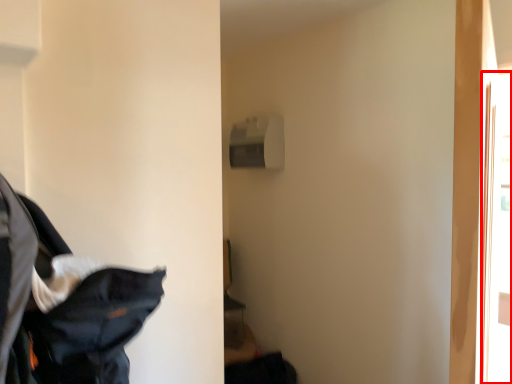
Question: Considering the relative positions of screen door (annotated by the red box) and laundry in the image provided, where is screen door (annotated by the red box) located with respect to the staircase?

Choices:
 (A) right
 (B) left

Answer: (A)